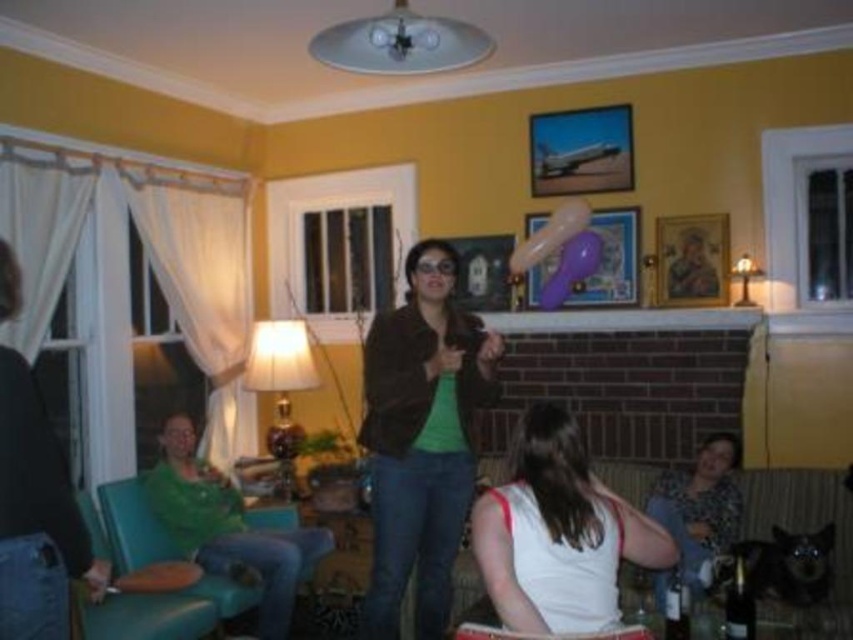
Looking at this image, you are standing at the entrance of the living room and see both the green jersey at lower left and the floral print dress at lower right. Which one is closer to you?

The green jersey at lower left is closer to you because it is further to the viewer than the floral print dress at lower right.

You are at a party in the living room and see the matte brown jacket at center and the metallic airplane at upper center. Which object is more to the left?

The matte brown jacket at center is more to the left because it is positioned on the left side of the metallic airplane at upper center.

You are a photographer trying to capture both the floral print dress at lower right and the matte plastic picture frame at upper center in a single shot. Which object should you focus on first to ensure both are in focus?

You should focus on the floral print dress at lower right first because it is closer to the viewer than the matte plastic picture frame at upper center, ensuring depth of field captures both.